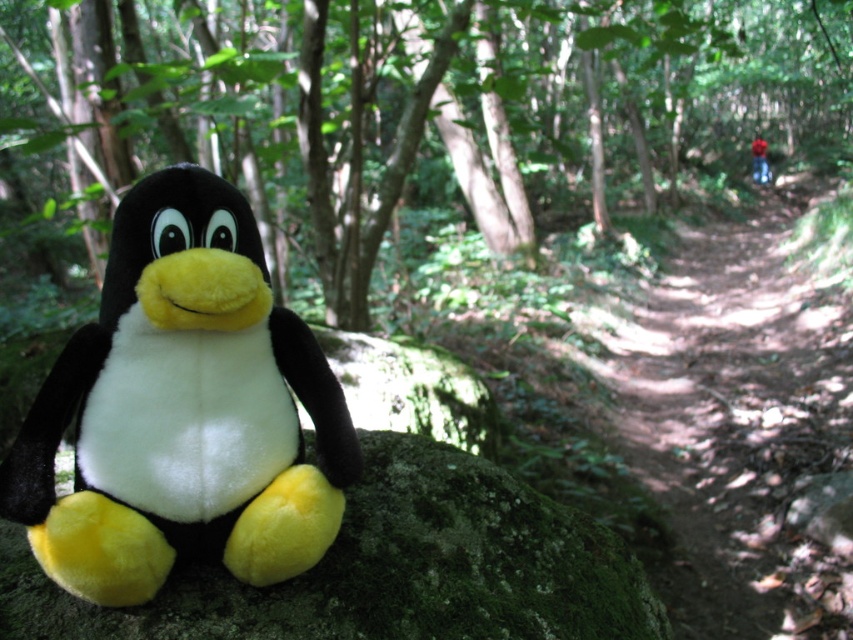
You are a hiker who wants to take a shortcut to reach the forest trail quickly. You see the dirt path at center and the green mossy rock at lower left. Which one should you choose to get to the forest trail faster?

The dirt path at center is positioned over the green mossy rock at lower left, so choosing the dirt path at center would be the faster route to the forest trail since it is directly above the rock and likely part of the established trail system.

You are a small child visiting a forest and see the soft plush penguin at left and the green mossy rock at lower left. Which object is bigger?

The soft plush penguin at left is smaller than the green mossy rock at lower left, so the green mossy rock at lower left is bigger.